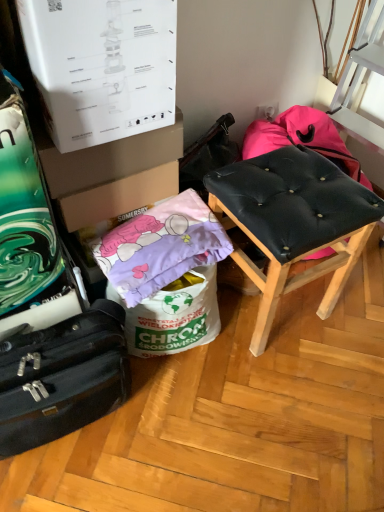
Question: Considering the relative sizes of black fabric suitcase at lower left and brown cardboard box at center, the 1th cardboard box positioned from the bottom, in the image provided, is black fabric suitcase at lower left bigger than brown cardboard box at center, the 1th cardboard box positioned from the bottom,?

Choices:
 (A) no
 (B) yes

Answer: (B)

Question: From the image's perspective, does black fabric suitcase at lower left appear higher than brown cardboard box at center, the 1th cardboard box positioned from the bottom?

Choices:
 (A) yes
 (B) no

Answer: (B)

Question: Is black fabric suitcase at lower left positioned behind brown cardboard box at center, the 1th cardboard box positioned from the bottom?

Choices:
 (A) yes
 (B) no

Answer: (B)

Question: Considering the relative sizes of black fabric suitcase at lower left and brown cardboard box at center, marked as the 2th cardboard box in a top-to-bottom arrangement, in the image provided, is black fabric suitcase at lower left wider than brown cardboard box at center, marked as the 2th cardboard box in a top-to-bottom arrangement,?

Choices:
 (A) yes
 (B) no

Answer: (B)

Question: Is black fabric suitcase at lower left shorter than brown cardboard box at center, marked as the 2th cardboard box in a top-to-bottom arrangement?

Choices:
 (A) yes
 (B) no

Answer: (B)

Question: Is black fabric suitcase at lower left to the left of brown cardboard box at center, the 1th cardboard box positioned from the bottom, from the viewer's perspective?

Choices:
 (A) no
 (B) yes

Answer: (B)

Question: Is black fabric suitcase at lower left looking in the opposite direction of purple fabric pillow at lower left?

Choices:
 (A) yes
 (B) no

Answer: (B)

Question: Is black fabric suitcase at lower left far from purple fabric pillow at lower left?

Choices:
 (A) no
 (B) yes

Answer: (A)

Question: From the image's perspective, is black fabric suitcase at lower left above purple fabric pillow at lower left?

Choices:
 (A) yes
 (B) no

Answer: (B)

Question: Is black fabric suitcase at lower left shorter than purple fabric pillow at lower left?

Choices:
 (A) no
 (B) yes

Answer: (A)

Question: Is purple fabric pillow at lower left surrounded by black fabric suitcase at lower left?

Choices:
 (A) no
 (B) yes

Answer: (A)

Question: Does black fabric suitcase at lower left have a smaller size compared to purple fabric pillow at lower left?

Choices:
 (A) yes
 (B) no

Answer: (B)

Question: From a real-world perspective, is black leather stool at right physically below brown cardboard box at upper left, acting as the second cardboard box starting from the bottom?

Choices:
 (A) no
 (B) yes

Answer: (B)